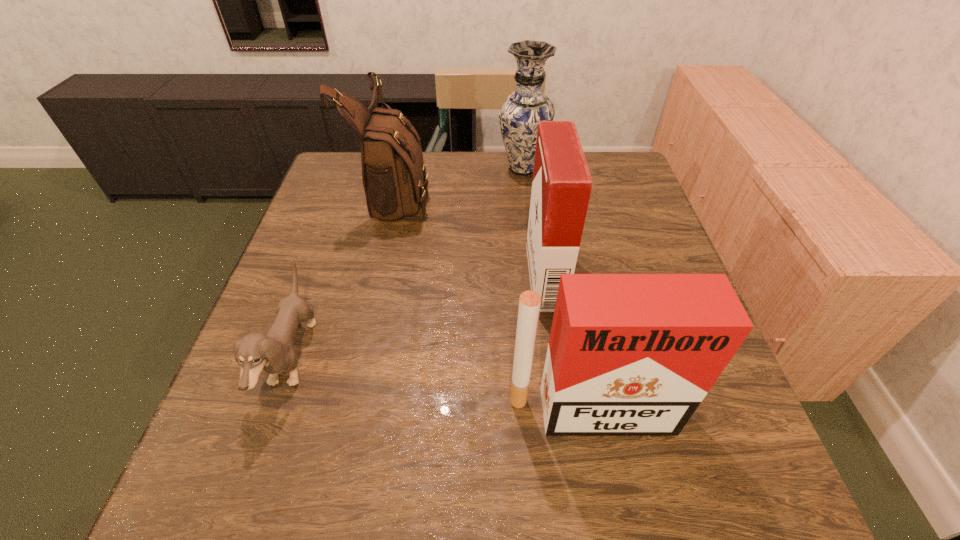
Image resolution: width=960 pixels, height=540 pixels. What are the coordinates of `vacant area situated 0.130m at the face of the puppy` in the screenshot? It's located at click(379, 359).

Locate an element on the screen. This screenshot has width=960, height=540. shoulder bag located in the far edge section of the desktop is located at coordinates (394, 176).

Identify the location of vase that is at the far edge. (x=521, y=111).

This screenshot has height=540, width=960. Find the location of `shoulder bag present at the left edge`. shoulder bag present at the left edge is located at coordinates (394, 176).

This screenshot has height=540, width=960. Find the location of `puppy situated at the left edge`. puppy situated at the left edge is located at coordinates (273, 353).

This screenshot has width=960, height=540. I want to click on object that is at the right edge, so click(629, 354).

The width and height of the screenshot is (960, 540). Find the location of `object positioned at the far left corner`. object positioned at the far left corner is located at coordinates (394, 176).

Locate an element on the screen. free location at the far edge of the desktop is located at coordinates (530, 188).

Where is `vacant position at the near edge of the desktop`? This screenshot has width=960, height=540. vacant position at the near edge of the desktop is located at coordinates (626, 461).

The height and width of the screenshot is (540, 960). I want to click on vacant area at the left edge of the desktop, so click(328, 341).